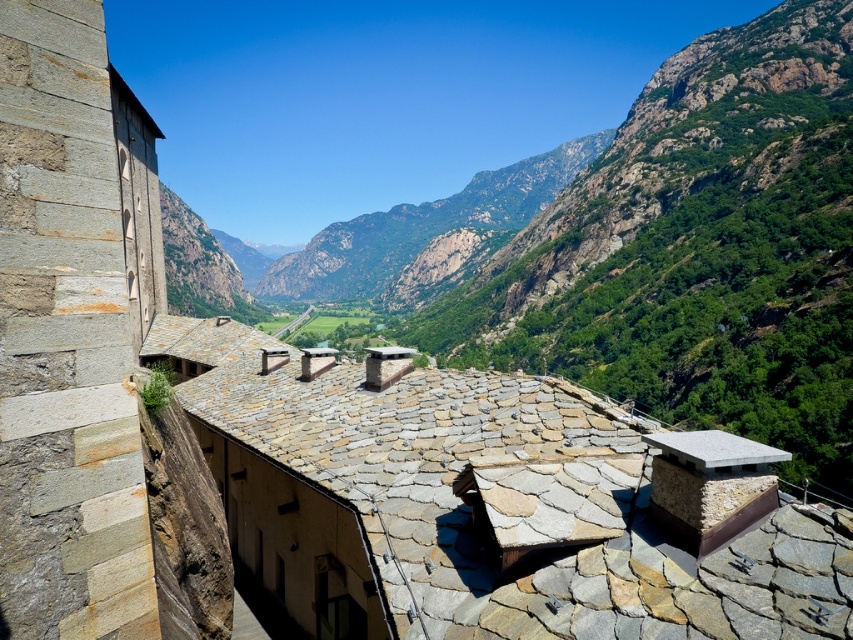
Question: Where is green rocky mountain at center located in relation to gray stone bench at lower right in the image?

Choices:
 (A) left
 (B) right

Answer: (A)

Question: Does gray stone roof at center appear under granite chimney at center?

Choices:
 (A) no
 (B) yes

Answer: (B)

Question: Which object is farther from the camera taking this photo?

Choices:
 (A) green rocky mountain at center
 (B) granite chimney at center
 (C) gray stone roof at center

Answer: (A)

Question: Among these points, which one is nearest to the camera?

Choices:
 (A) (666, 444)
 (B) (833, 636)

Answer: (B)

Question: Estimate the real-world distances between objects in this image. Which object is farther from the granite chimney at center?

Choices:
 (A) gray stone roof at center
 (B) green rocky mountain at center

Answer: (B)

Question: Where is granite chimney at center located in relation to gray stone bench at lower right in the image?

Choices:
 (A) left
 (B) right

Answer: (A)